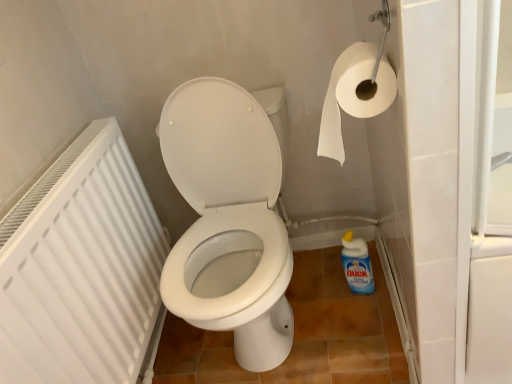
Question: Considering the relative positions of white paper at upper right and white plastic radiator at left in the image provided, is white paper at upper right in front of white plastic radiator at left?

Choices:
 (A) no
 (B) yes

Answer: (A)

Question: From the image's perspective, is white paper at upper right located above white plastic radiator at left?

Choices:
 (A) no
 (B) yes

Answer: (B)

Question: Is white paper at upper right far from white plastic radiator at left?

Choices:
 (A) no
 (B) yes

Answer: (A)

Question: Considering the relative sizes of white paper at upper right and white plastic radiator at left in the image provided, is white paper at upper right taller than white plastic radiator at left?

Choices:
 (A) no
 (B) yes

Answer: (A)

Question: From a real-world perspective, is white paper at upper right located beneath white plastic radiator at left?

Choices:
 (A) yes
 (B) no

Answer: (B)

Question: Is point (145, 203) closer or farther from the camera than point (355, 266)?

Choices:
 (A) farther
 (B) closer

Answer: (A)

Question: From the image's perspective, is white plastic radiator at left located above or below blue glossy bottle at lower right?

Choices:
 (A) above
 (B) below

Answer: (A)

Question: Is white plastic radiator at left bigger or smaller than blue glossy bottle at lower right?

Choices:
 (A) big
 (B) small

Answer: (A)

Question: Relative to blue glossy bottle at lower right, is white plastic radiator at left in front or behind?

Choices:
 (A) behind
 (B) front

Answer: (B)

Question: Considering their positions, is blue glossy bottle at lower right located in front of or behind white paper at upper right?

Choices:
 (A) behind
 (B) front

Answer: (A)

Question: Looking at the image, does blue glossy bottle at lower right seem bigger or smaller compared to white paper at upper right?

Choices:
 (A) small
 (B) big

Answer: (A)

Question: Considering the positions of blue glossy bottle at lower right and white paper at upper right in the image, is blue glossy bottle at lower right taller or shorter than white paper at upper right?

Choices:
 (A) tall
 (B) short

Answer: (A)

Question: From a real-world perspective, relative to white paper at upper right, is blue glossy bottle at lower right vertically above or below?

Choices:
 (A) above
 (B) below

Answer: (B)

Question: Considering the relative positions of blue glossy bottle at lower right and white plastic radiator at left in the image provided, is blue glossy bottle at lower right to the left or to the right of white plastic radiator at left?

Choices:
 (A) right
 (B) left

Answer: (A)

Question: Considering the positions of blue glossy bottle at lower right and white plastic radiator at left in the image, is blue glossy bottle at lower right taller or shorter than white plastic radiator at left?

Choices:
 (A) short
 (B) tall

Answer: (A)